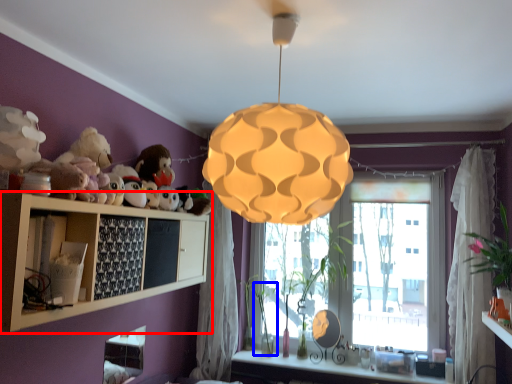
Question: Which object appears closest to the camera in this image, shelf (highlighted by a red box) or plant (highlighted by a blue box)?

Choices:
 (A) shelf
 (B) plant

Answer: (A)